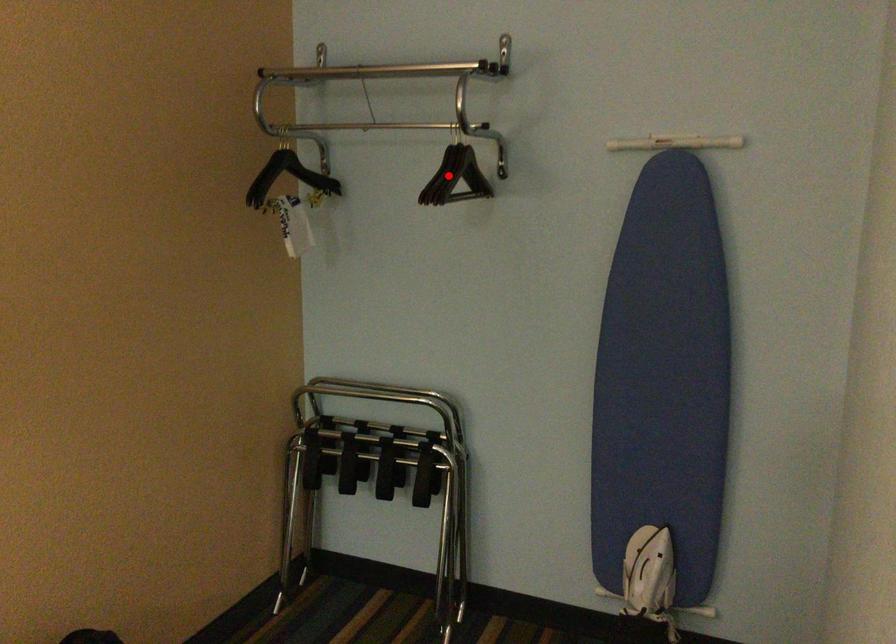
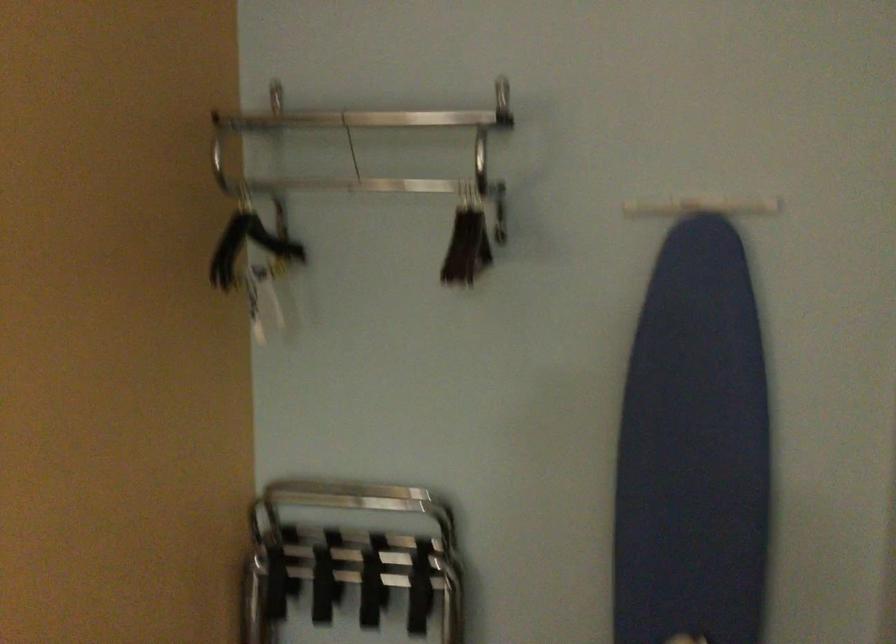
Where in the second image is the point corresponding to the highlighted location from the first image?

(467, 245)